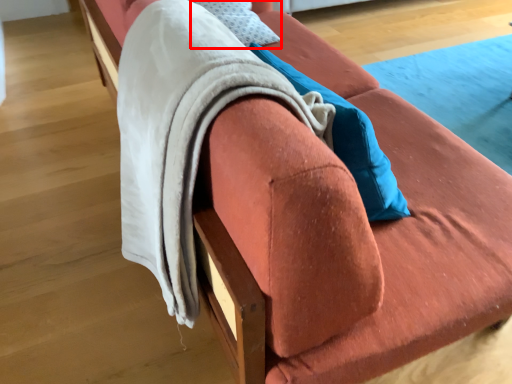
Question: From the image's perspective, considering the relative positions of pillow (annotated by the red box) and blanket in the image provided, where is pillow (annotated by the red box) located with respect to the staircase?

Choices:
 (A) above
 (B) below

Answer: (A)